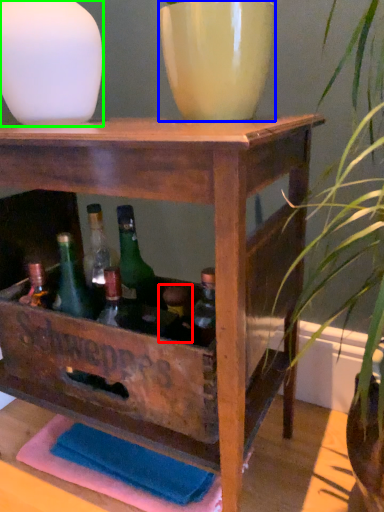
Question: Which object is positioned farthest from bottle (highlighted by a red box)? Select from flowerpot (highlighted by a blue box) and vase (highlighted by a green box).

Choices:
 (A) flowerpot
 (B) vase

Answer: (B)